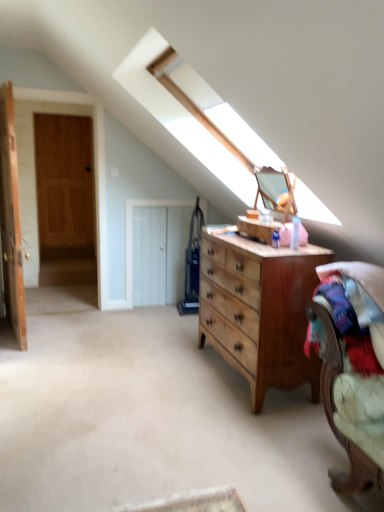
Question: Could you tell me if velvet-like beige armchair at lower right is facing white wooden door at center, positioned as the 3th door in left-to-right order?

Choices:
 (A) no
 (B) yes

Answer: (A)

Question: Can you confirm if velvet-like beige armchair at lower right is positioned to the right of white wooden door at center, which appears as the 1th door when viewed from the right?

Choices:
 (A) no
 (B) yes

Answer: (B)

Question: Considering the relative sizes of velvet-like beige armchair at lower right and white wooden door at center, positioned as the 3th door in left-to-right order, in the image provided, is velvet-like beige armchair at lower right smaller than white wooden door at center, positioned as the 3th door in left-to-right order,?

Choices:
 (A) no
 (B) yes

Answer: (A)

Question: Is velvet-like beige armchair at lower right to the left of white wooden door at center, positioned as the 3th door in left-to-right order, from the viewer's perspective?

Choices:
 (A) yes
 (B) no

Answer: (B)

Question: Is there a large distance between velvet-like beige armchair at lower right and white wooden door at center, which appears as the 1th door when viewed from the right?

Choices:
 (A) no
 (B) yes

Answer: (B)

Question: Considering the positions of point (72, 141) and point (367, 411), is point (72, 141) closer or farther from the camera than point (367, 411)?

Choices:
 (A) farther
 (B) closer

Answer: (A)

Question: Is wooden door at left, which appears as the 2th door when viewed from the right, spatially inside velvet-like beige armchair at lower right, or outside of it?

Choices:
 (A) inside
 (B) outside

Answer: (B)

Question: Considering the relative positions of wooden door at left, placed as the second door when sorted from left to right, and velvet-like beige armchair at lower right in the image provided, is wooden door at left, placed as the second door when sorted from left to right, to the left or to the right of velvet-like beige armchair at lower right?

Choices:
 (A) right
 (B) left

Answer: (B)

Question: From a real-world perspective, is wooden door at left, placed as the second door when sorted from left to right, positioned above or below velvet-like beige armchair at lower right?

Choices:
 (A) above
 (B) below

Answer: (A)

Question: Considering the positions of point (3, 88) and point (299, 352), is point (3, 88) closer or farther from the camera than point (299, 352)?

Choices:
 (A) closer
 (B) farther

Answer: (B)

Question: From a real-world perspective, is wooden door at left, placed as the first door when sorted from left to right, above or below wooden dresser at center?

Choices:
 (A) below
 (B) above

Answer: (B)

Question: Is wooden door at left, which ranks as the 3th door in right-to-left order, spatially inside wooden dresser at center, or outside of it?

Choices:
 (A) outside
 (B) inside

Answer: (A)

Question: Is wooden door at left, which ranks as the 3th door in right-to-left order, taller or shorter than wooden dresser at center?

Choices:
 (A) tall
 (B) short

Answer: (A)

Question: Considering the positions of point (380, 415) and point (150, 267), is point (380, 415) closer or farther from the camera than point (150, 267)?

Choices:
 (A) closer
 (B) farther

Answer: (A)

Question: From the image's perspective, is velvet-like beige armchair at lower right positioned above or below white wooden door at center, positioned as the 3th door in left-to-right order?

Choices:
 (A) above
 (B) below

Answer: (B)